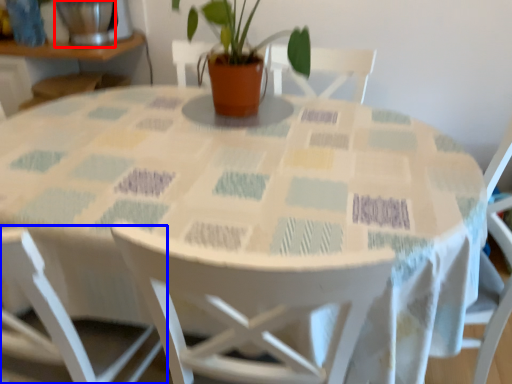
Question: Among these objects, which one is nearest to the camera, glass vase (highlighted by a red box) or chair (highlighted by a blue box)?

Choices:
 (A) glass vase
 (B) chair

Answer: (B)